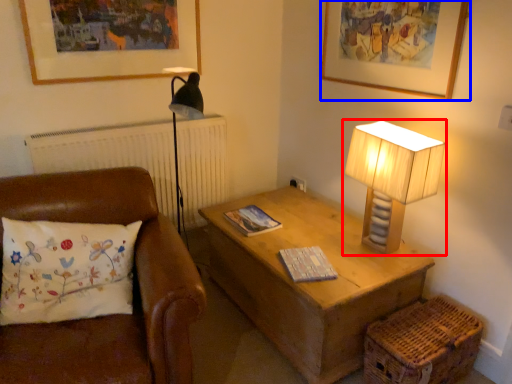
Question: Which object appears closest to the camera in this image, lamp (highlighted by a red box) or picture frame (highlighted by a blue box)?

Choices:
 (A) lamp
 (B) picture frame

Answer: (B)